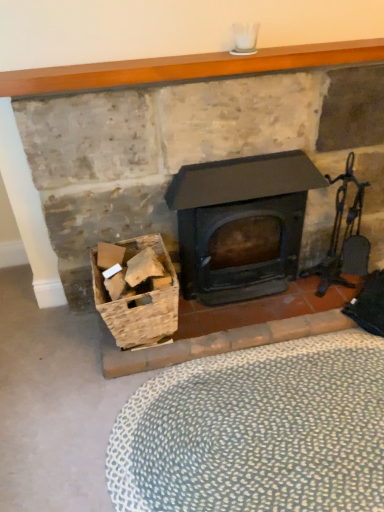
You are a GUI agent. You are given a task and a screenshot of the screen. Output one action in this format:
    pyautogui.click(x=<x>, y=<y>)
    Task: Click on the vacant area situated below metallic dark brown fireplace tool set at right (from a real-world perspective)
    
    Given the screenshot: What is the action you would take?
    pyautogui.click(x=329, y=291)